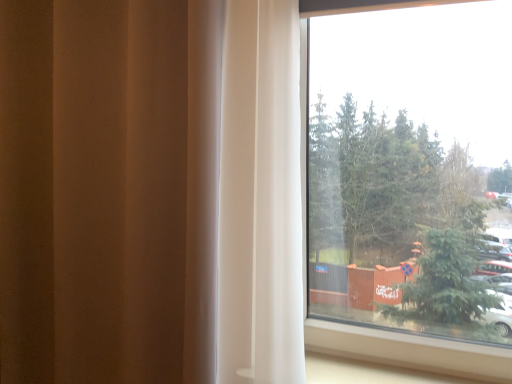
The height and width of the screenshot is (384, 512). Identify the location of white sheer curtain at right. (108, 190).

Describe the element at coordinates (108, 190) in the screenshot. The width and height of the screenshot is (512, 384). I see `white sheer curtain at right` at that location.

Describe the element at coordinates (403, 171) in the screenshot. I see `transparent glass window at upper right` at that location.

Measure the distance between point (313, 78) and camera.

Point (313, 78) and camera are 1.31 meters apart from each other.

Identify the location of transparent glass window at upper right. The image size is (512, 384). (403, 171).

Identify the location of white sheer curtain at right. (108, 190).

Is white sheer curtain at right at the right side of transparent glass window at upper right?

No.

Which object is closer to the camera, white sheer curtain at right or transparent glass window at upper right?

white sheer curtain at right is more forward.

Is point (92, 347) farther from viewer compared to point (417, 213)?

Yes, it is behind point (417, 213).

From the image's perspective, which is above, white sheer curtain at right or transparent glass window at upper right?

transparent glass window at upper right.

From a real-world perspective, which is physically above, white sheer curtain at right or transparent glass window at upper right?

transparent glass window at upper right.

In terms of width, does white sheer curtain at right look wider or thinner when compared to transparent glass window at upper right?

Clearly, white sheer curtain at right has more width compared to transparent glass window at upper right.

Considering the sizes of objects white sheer curtain at right and transparent glass window at upper right in the image provided, who is taller, white sheer curtain at right or transparent glass window at upper right?

white sheer curtain at right.

From the picture: Which of these two, white sheer curtain at right or transparent glass window at upper right, is smaller?

transparent glass window at upper right is smaller.

Is white sheer curtain at right inside the boundaries of transparent glass window at upper right, or outside?

white sheer curtain at right lies outside transparent glass window at upper right.

Is there a large distance between white sheer curtain at right and transparent glass window at upper right?

No.

Does white sheer curtain at right turn towards transparent glass window at upper right?

No, white sheer curtain at right does not turn towards transparent glass window at upper right.

How many degrees apart are the facing directions of white sheer curtain at right and transparent glass window at upper right?

The angular difference between white sheer curtain at right and transparent glass window at upper right is 0.0344 degrees.

At what (x,y) coordinates should I click in order to perform the action: click on curtain below the transparent glass window at upper right (from the image's perspective). Please return your answer as a coordinate pair (x, y). The height and width of the screenshot is (384, 512). Looking at the image, I should click on (108, 190).

Is transparent glass window at upper right to the left or to the right of white sheer curtain at right in the image?

transparent glass window at upper right is positioned on white sheer curtain at right's right side.

Relative to white sheer curtain at right, is transparent glass window at upper right in front or behind?

Clearly, transparent glass window at upper right is behind white sheer curtain at right.

Does point (426, 166) come in front of point (97, 275)?

Yes, it is in front of point (97, 275).

From the image's perspective, does transparent glass window at upper right appear lower than white sheer curtain at right?

No, from the image's perspective, transparent glass window at upper right is not below white sheer curtain at right.

From a real-world perspective, who is located lower, transparent glass window at upper right or white sheer curtain at right?

white sheer curtain at right is physically lower.

Considering the sizes of objects transparent glass window at upper right and white sheer curtain at right in the image provided, who is wider, transparent glass window at upper right or white sheer curtain at right?

With larger width is white sheer curtain at right.

Which of these two, transparent glass window at upper right or white sheer curtain at right, stands taller?

Standing taller between the two is white sheer curtain at right.

Between transparent glass window at upper right and white sheer curtain at right, which one has smaller size?

transparent glass window at upper right.

Which is correct: transparent glass window at upper right is inside white sheer curtain at right, or outside of it?

transparent glass window at upper right is located beyond the bounds of white sheer curtain at right.

Is transparent glass window at upper right not near white sheer curtain at right?

They are positioned close to each other.

Is transparent glass window at upper right facing away from white sheer curtain at right?

No, white sheer curtain at right is not at the back of transparent glass window at upper right.

How different are the orientations of transparent glass window at upper right and white sheer curtain at right in degrees?

0.0344 degrees separate the facing orientations of transparent glass window at upper right and white sheer curtain at right.

How distant is transparent glass window at upper right from white sheer curtain at right?

transparent glass window at upper right is 23.95 inches from white sheer curtain at right.

Locate an element on the screen. The width and height of the screenshot is (512, 384). window that appears behind the white sheer curtain at right is located at coordinates (403, 171).

Locate an element on the screen. Image resolution: width=512 pixels, height=384 pixels. window lying on the right of white sheer curtain at right is located at coordinates (403, 171).

The height and width of the screenshot is (384, 512). What are the coordinates of `curtain below the transparent glass window at upper right (from a real-world perspective)` in the screenshot? It's located at (108, 190).